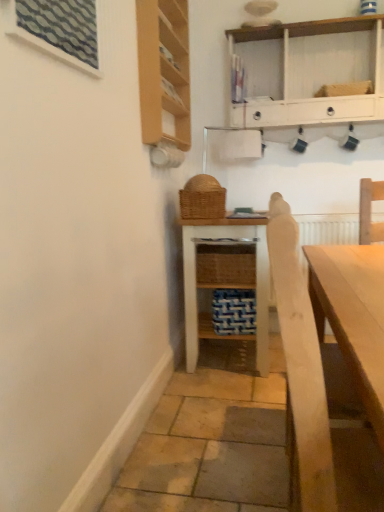
Question: From a real-world perspective, is textured glass window at upper left beneath white painted wood shelf at upper center, arranged as the first shelf when viewed from the top?

Choices:
 (A) yes
 (B) no

Answer: (A)

Question: Is textured glass window at upper left positioned in front of white painted wood shelf at upper center, positioned as the second shelf in bottom-to-top order?

Choices:
 (A) yes
 (B) no

Answer: (A)

Question: Considering the relative sizes of textured glass window at upper left and white painted wood shelf at upper center, arranged as the first shelf when viewed from the top, in the image provided, is textured glass window at upper left taller than white painted wood shelf at upper center, arranged as the first shelf when viewed from the top,?

Choices:
 (A) no
 (B) yes

Answer: (A)

Question: Can you confirm if textured glass window at upper left is positioned to the right of white painted wood shelf at upper center, positioned as the second shelf in bottom-to-top order?

Choices:
 (A) no
 (B) yes

Answer: (A)

Question: Is textured glass window at upper left positioned beyond the bounds of white painted wood shelf at upper center, positioned as the second shelf in bottom-to-top order?

Choices:
 (A) no
 (B) yes

Answer: (B)

Question: Would you say woven brown basket at center is inside or outside light wood cabinet at upper left?

Choices:
 (A) outside
 (B) inside

Answer: (A)

Question: From the image's perspective, is woven brown basket at center located above or below light wood cabinet at upper left?

Choices:
 (A) below
 (B) above

Answer: (A)

Question: In terms of height, does woven brown basket at center look taller or shorter compared to light wood cabinet at upper left?

Choices:
 (A) short
 (B) tall

Answer: (A)

Question: Considering the positions of point (205, 201) and point (150, 32), is point (205, 201) closer or farther from the camera than point (150, 32)?

Choices:
 (A) closer
 (B) farther

Answer: (B)

Question: Based on their sizes in the image, would you say textured glass window at upper left is bigger or smaller than white wicker shelf at center, the second shelf when ordered from top to bottom?

Choices:
 (A) small
 (B) big

Answer: (A)

Question: From a real-world perspective, is textured glass window at upper left above or below white wicker shelf at center, the second shelf when ordered from top to bottom?

Choices:
 (A) above
 (B) below

Answer: (A)

Question: In the image, is textured glass window at upper left on the left side or the right side of white wicker shelf at center, placed as the 1th shelf when sorted from bottom to top?

Choices:
 (A) left
 (B) right

Answer: (A)

Question: Is textured glass window at upper left inside or outside of white wicker shelf at center, the second shelf when ordered from top to bottom?

Choices:
 (A) inside
 (B) outside

Answer: (B)

Question: Is white wicker shelf at center, placed as the 1th shelf when sorted from bottom to top, inside or outside of woven brown basket at center?

Choices:
 (A) outside
 (B) inside

Answer: (A)

Question: Looking at the image, does white wicker shelf at center, the second shelf when ordered from top to bottom, seem bigger or smaller compared to woven brown basket at center?

Choices:
 (A) big
 (B) small

Answer: (A)